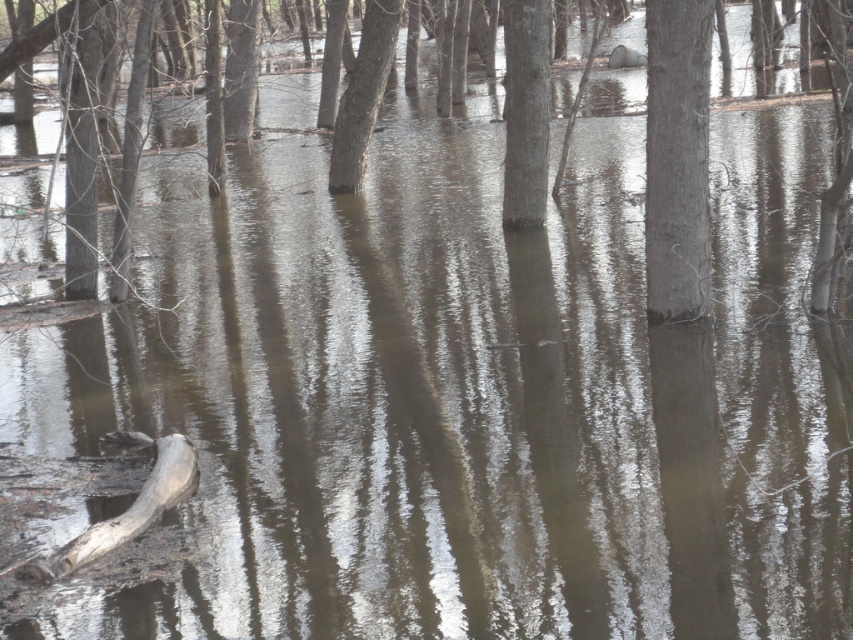
Question: Is smooth gray tree trunk at center further to camera compared to gray wood log at lower left?

Choices:
 (A) no
 (B) yes

Answer: (B)

Question: Which point is farther from the camera taking this photo?

Choices:
 (A) (99, 528)
 (B) (706, 304)

Answer: (B)

Question: Is smooth gray tree trunk at center above brown matte tree at center?

Choices:
 (A) no
 (B) yes

Answer: (A)

Question: Among these objects, which one is farthest from the camera?

Choices:
 (A) brown matte tree at center
 (B) smooth gray tree trunk at center
 (C) gray wood log at lower left

Answer: (B)

Question: Estimate the real-world distances between objects in this image. Which object is farther from the brown matte tree at center?

Choices:
 (A) gray wood log at lower left
 (B) smooth gray tree trunk at center

Answer: (B)

Question: Can you confirm if smooth gray tree trunk at center is smaller than brown matte tree at center?

Choices:
 (A) no
 (B) yes

Answer: (B)